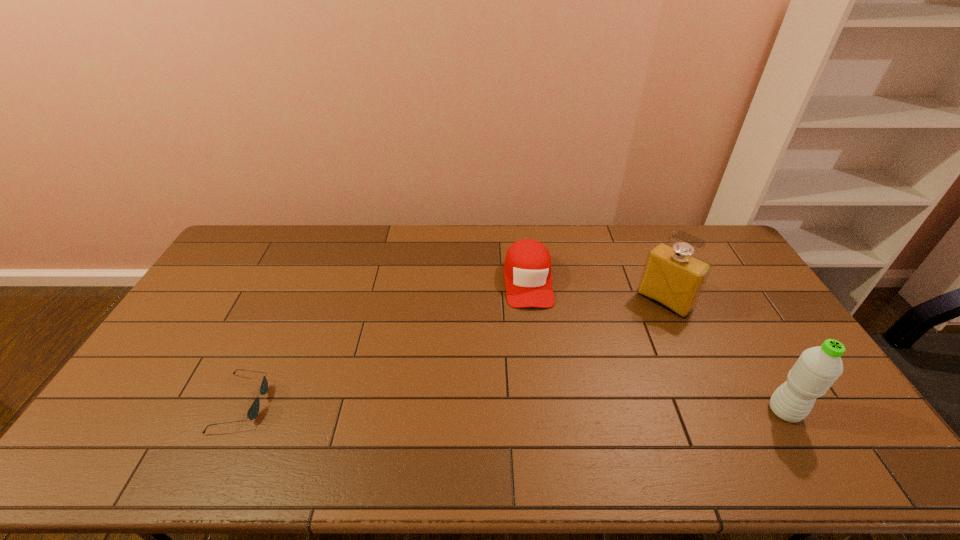
The height and width of the screenshot is (540, 960). I want to click on free space on the desktop that is between the leftmost object and the water bottle and is positioned on the front-facing side of the third object from right to left, so point(542,408).

Locate an element on the screen. The image size is (960, 540). vacant space on the desktop that is between the shortest object and the water bottle and is positioned on the front-facing side of the perfume is located at coordinates (556, 408).